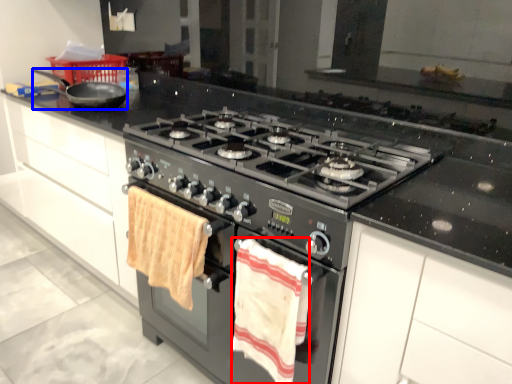
Question: Which object appears closest to the camera in this image, beach towel (highlighted by a red box) or frying pan (highlighted by a blue box)?

Choices:
 (A) beach towel
 (B) frying pan

Answer: (A)